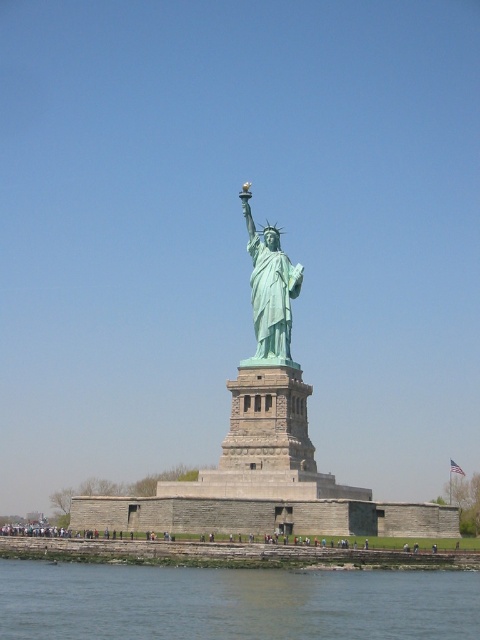
Does greenish water at lower center appear over green patina statue at center?

Incorrect, greenish water at lower center is not positioned above green patina statue at center.

Where is `greenish water at lower center`? The width and height of the screenshot is (480, 640). greenish water at lower center is located at coordinates (232, 602).